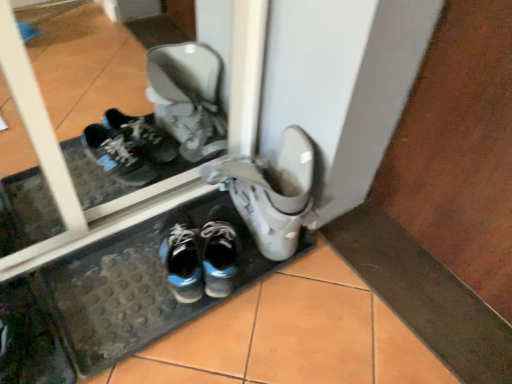
This screenshot has height=384, width=512. I want to click on free location to the left of shiny blue running shoe at center, so click(121, 264).